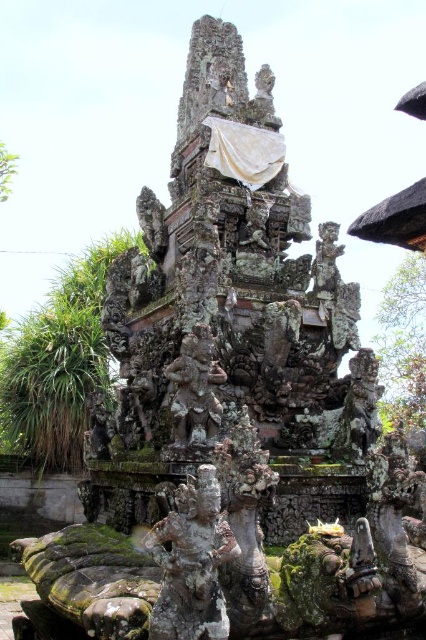
Can you confirm if bronze statue at center is positioned to the right of carved stone statue at upper center?

Incorrect, bronze statue at center is not on the right side of carved stone statue at upper center.

Is bronze statue at center above carved stone statue at upper center?

Incorrect, bronze statue at center is not positioned above carved stone statue at upper center.

Where is `bronze statue at center`? The height and width of the screenshot is (640, 426). bronze statue at center is located at coordinates (195, 388).

Is green stone statue at center above rusty stone statue at center?

No.

Between green stone statue at center and rusty stone statue at center, which one is positioned lower?

green stone statue at center is below.

Measure the distance between green stone statue at center and camera.

green stone statue at center is 41.41 meters from camera.

Locate an element on the screen. The height and width of the screenshot is (640, 426). green stone statue at center is located at coordinates [192, 561].

Describe the element at coordinates (359, 410) in the screenshot. This screenshot has height=640, width=426. I see `rusty stone statue at center` at that location.

How far apart are rusty stone statue at center and carved stone statue at upper center?

The distance of rusty stone statue at center from carved stone statue at upper center is 12.43 meters.

Between point (344, 445) and point (342, 252), which one is positioned behind?

Positioned behind is point (342, 252).

The image size is (426, 640). Identify the location of rusty stone statue at center. (359, 410).